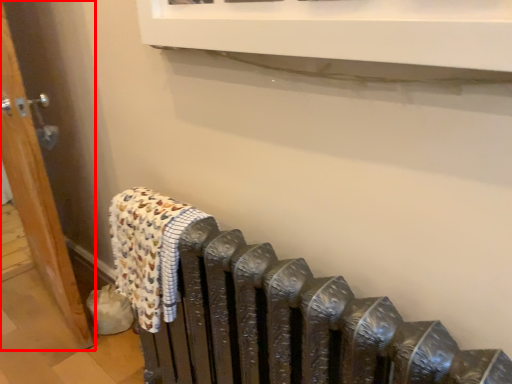
Question: From the image's perspective, considering the relative positions of door (annotated by the red box) and bath towel in the image provided, where is door (annotated by the red box) located with respect to the staircase?

Choices:
 (A) above
 (B) below

Answer: (A)